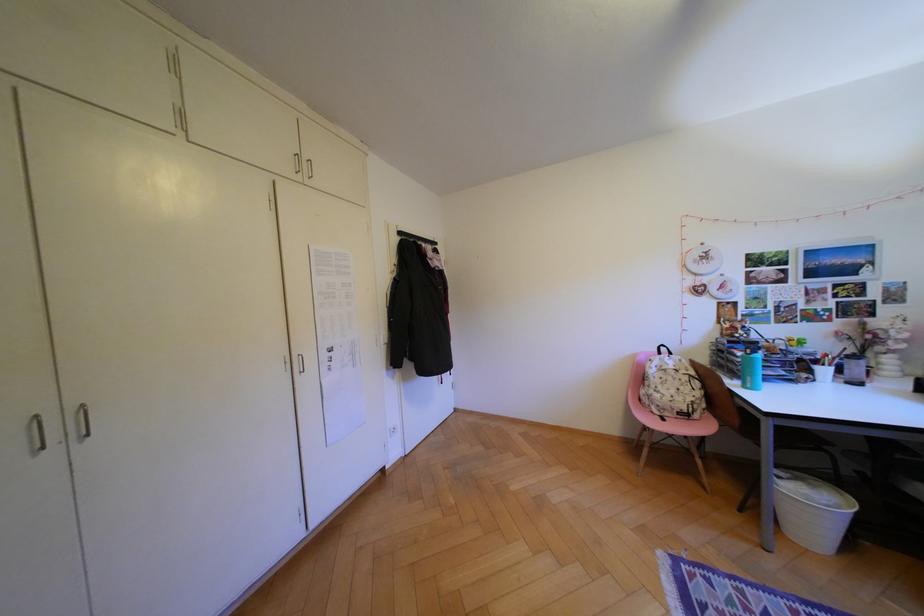
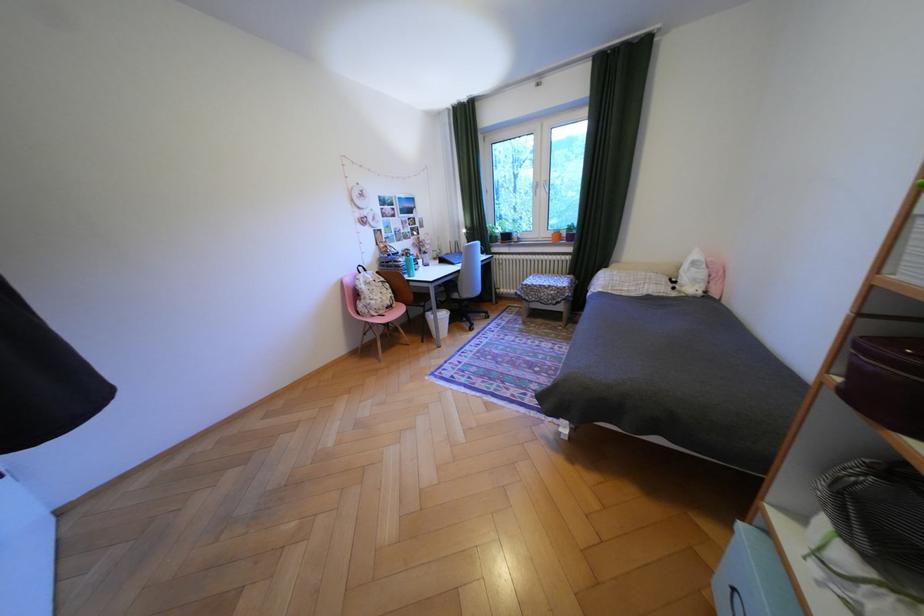
Where in the second image is the point corresponding to point 751,354 from the first image?

(411, 259)